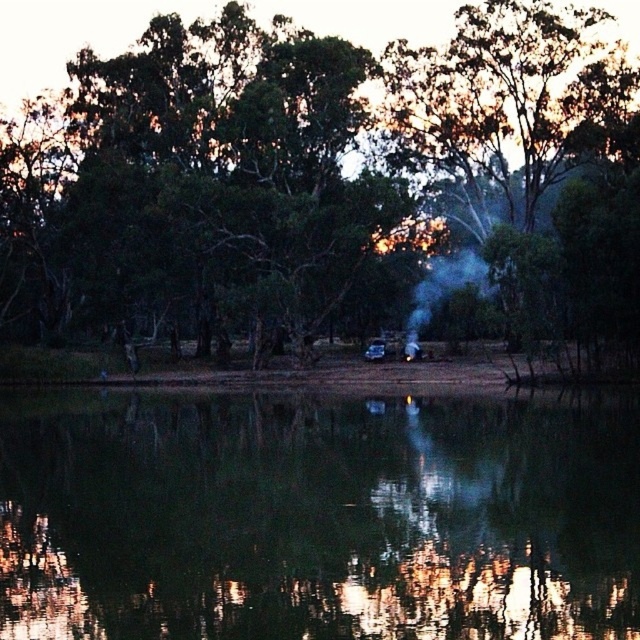
What do you see at coordinates (317, 516) in the screenshot?
I see `green reflective water at center` at bounding box center [317, 516].

Who is more forward, (188,518) or (397,102)?

Point (188,518) is in front.

In order to click on green reflective water at center in this screenshot , I will do [317, 516].

Does green leafy tree at center appear on the right side of white smoke at center?

No, green leafy tree at center is not to the right of white smoke at center.

Is green leafy tree at center further to the viewer compared to white smoke at center?

No, it is not.

Locate an element on the screen. The height and width of the screenshot is (640, 640). green leafy tree at center is located at coordinates click(x=188, y=179).

The height and width of the screenshot is (640, 640). What do you see at coordinates (317, 516) in the screenshot?
I see `green reflective water at center` at bounding box center [317, 516].

Can you confirm if green reflective water at center is smaller than white smoke at center?

Incorrect, green reflective water at center is not smaller in size than white smoke at center.

Locate an element on the screen. green reflective water at center is located at coordinates (317, 516).